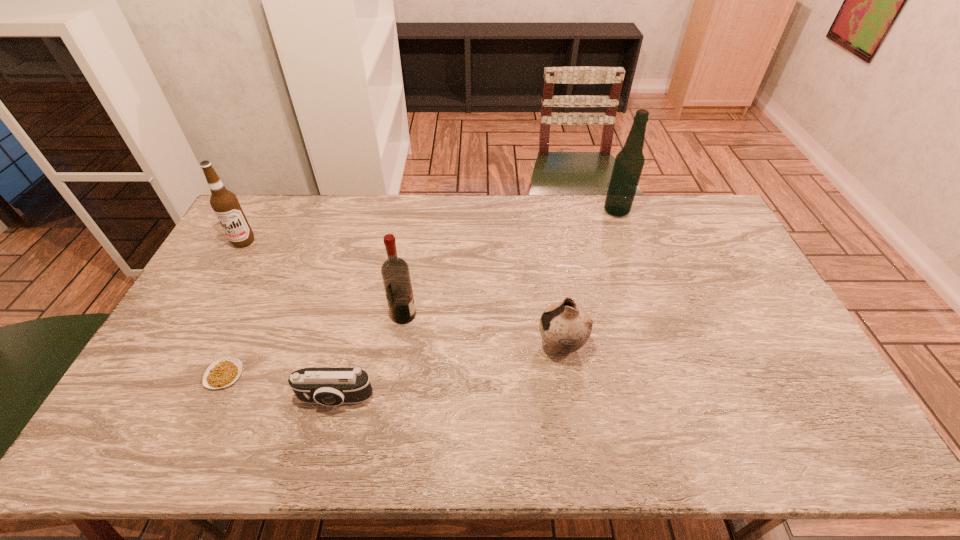
The height and width of the screenshot is (540, 960). Find the location of `the tallest object`. the tallest object is located at coordinates (629, 162).

The width and height of the screenshot is (960, 540). I want to click on the farthest alcohol, so click(629, 162).

At what (x,y) coordinates should I click in order to perform the action: click on the second farthest alcohol. Please return your answer as a coordinate pair (x, y). This screenshot has height=540, width=960. Looking at the image, I should click on (225, 204).

In order to click on the second farthest object in this screenshot , I will do `click(225, 204)`.

What are the coordinates of `the second alcohol from right to left` in the screenshot? It's located at (395, 273).

Where is `the third object from right to left`? the third object from right to left is located at coordinates (395, 273).

You are a GUI agent. You are given a task and a screenshot of the screen. Output one action in this format:
    pyautogui.click(x=<x>, y=<y>)
    Task: Click on the fourth tallest object
    
    Given the screenshot: What is the action you would take?
    pyautogui.click(x=565, y=327)

You are a GUI agent. You are given a task and a screenshot of the screen. Output one action in this format:
    pyautogui.click(x=<x>, y=<y>)
    Task: Click on the fifth object from left to right
    
    Given the screenshot: What is the action you would take?
    pyautogui.click(x=565, y=327)

I want to click on the second shortest object, so click(x=327, y=386).

Where is `the fourth object from right to left`? the fourth object from right to left is located at coordinates (327, 386).